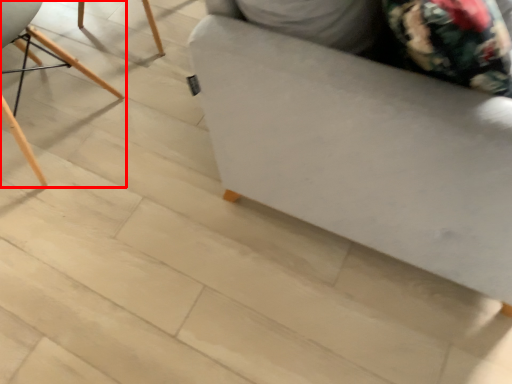
Question: From the image's perspective, where is chair (annotated by the red box) located relative to furniture?

Choices:
 (A) above
 (B) below

Answer: (B)